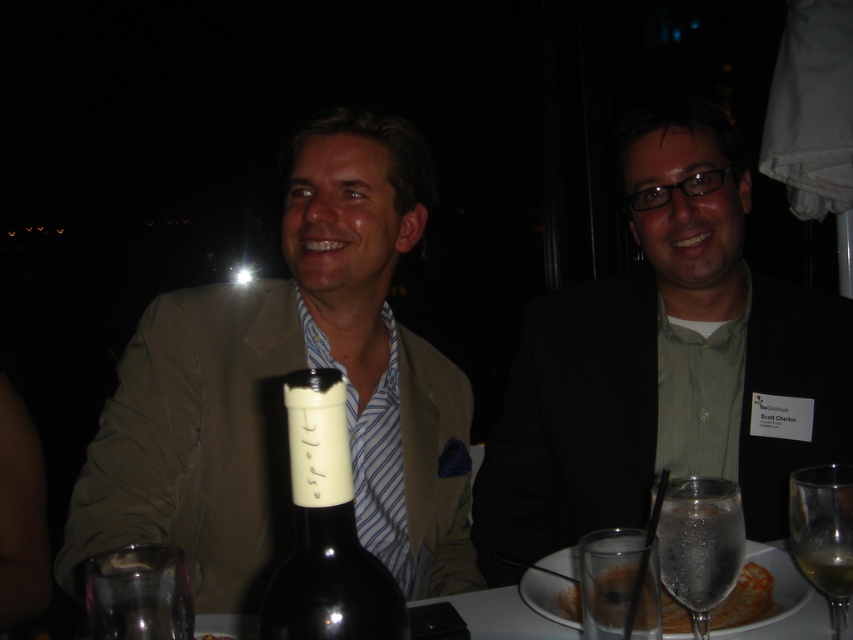
Question: Which of the following is the farthest from the observer?

Choices:
 (A) translucent glass plate at lower right
 (B) light beige suit at center
 (C) clear glass at lower left
 (D) clear glass at lower right

Answer: (B)

Question: Which point appears farthest from the camera in this image?

Choices:
 (A) (619, 477)
 (B) (796, 525)
 (C) (151, 595)

Answer: (A)

Question: In this image, where is light beige suit at center located relative to matte black suit at center?

Choices:
 (A) above
 (B) below

Answer: (B)

Question: In this image, where is matte black suit at center located relative to clear glass at lower left?

Choices:
 (A) right
 (B) left

Answer: (A)

Question: Is light beige suit at center thinner than clear glass at lower left?

Choices:
 (A) no
 (B) yes

Answer: (A)

Question: Estimate the real-world distances between objects in this image. Which object is farther from the clear glass at lower right?

Choices:
 (A) clear glass wine glass at lower right
 (B) dark glass bottle at center
 (C) light beige suit at center

Answer: (C)